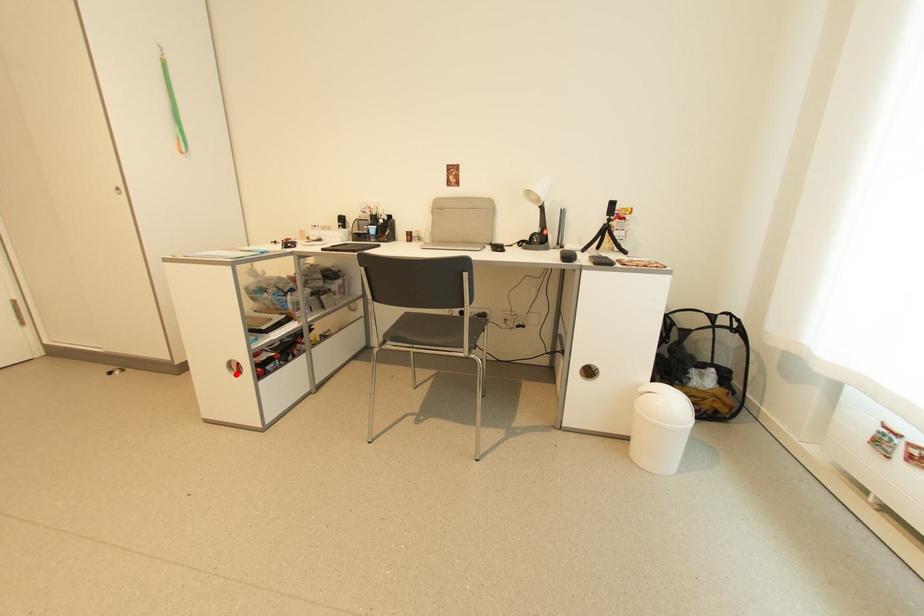
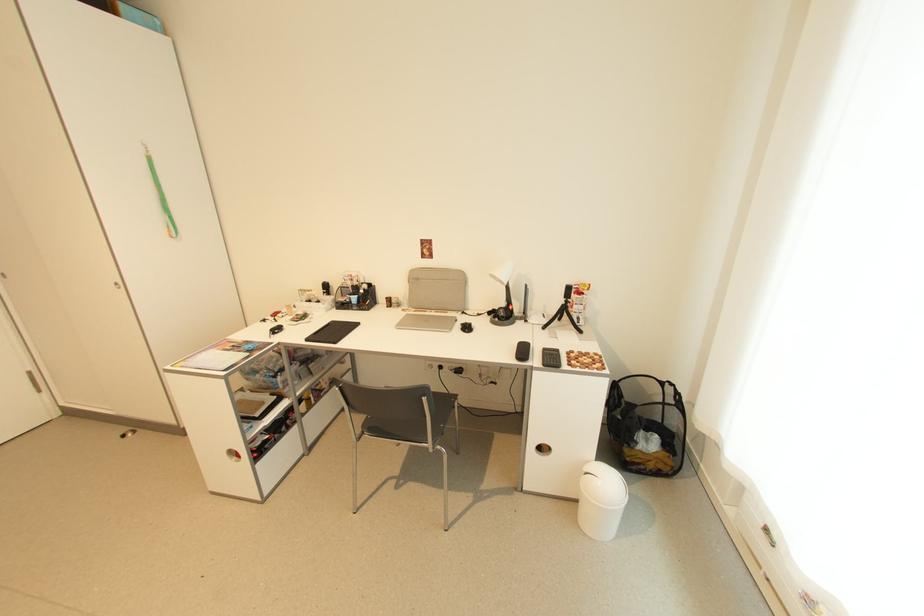
Find the pixel in the second image that matches the highlighted location in the first image.

(237, 460)